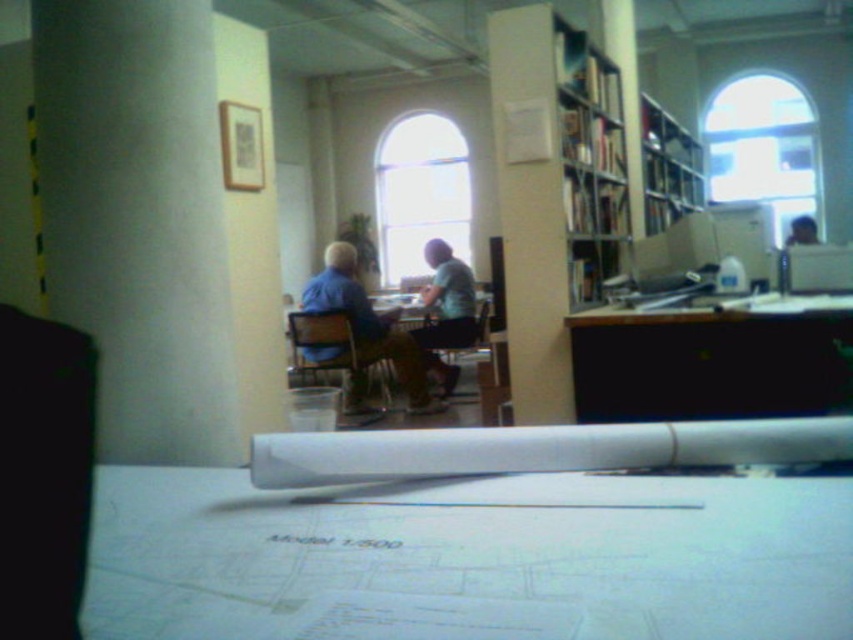
You are an office worker who needs to place a 1.2 meter tall printer on the black glossy table at center. Considering the height of the light blue fabric shirt at center, will the printer fit on the table without exceeding the table height?

The black glossy table at center is not as tall as the light blue fabric shirt at center. Since the height of the table is less than the shirt, and the printer is 1.2 meters tall, it might exceed the table height. However, without exact measurements, we can infer that the table is shorter than the shirt. If the shirt is taller than 1.2 meters, the printer would fit. If the shirt is shorter, it won

Is the black glossy table at center wider than the light blue fabric shirt at center?

The black glossy table at center is wider than the light blue fabric shirt at center according to the description.